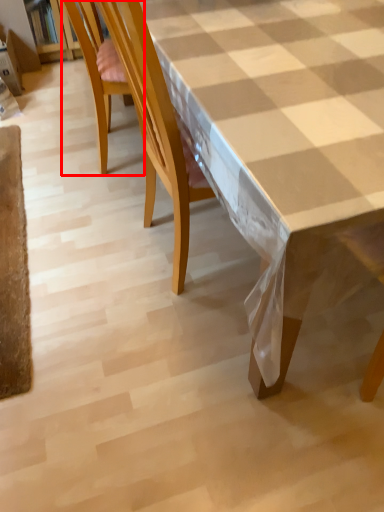
Question: In this image, where is chair (annotated by the red box) located relative to table?

Choices:
 (A) left
 (B) right

Answer: (A)